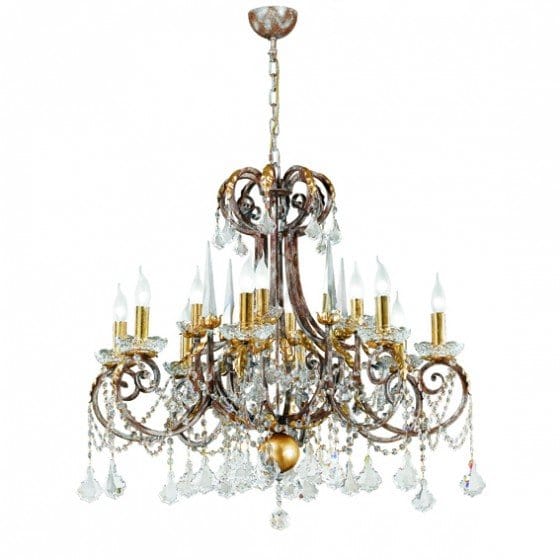
Where is `chandelier`? This screenshot has height=560, width=560. chandelier is located at coordinates (301, 283).